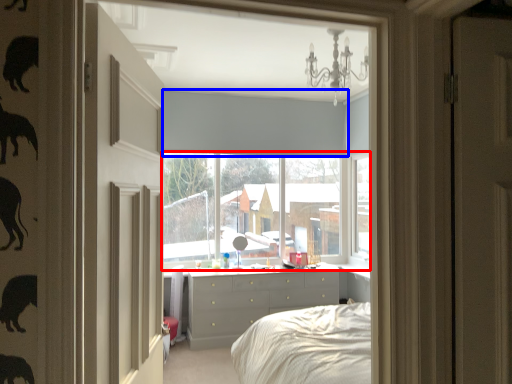
Question: Among these objects, which one is nearest to the camera, window (highlighted by a red box) or blind (highlighted by a blue box)?

Choices:
 (A) window
 (B) blind

Answer: (B)